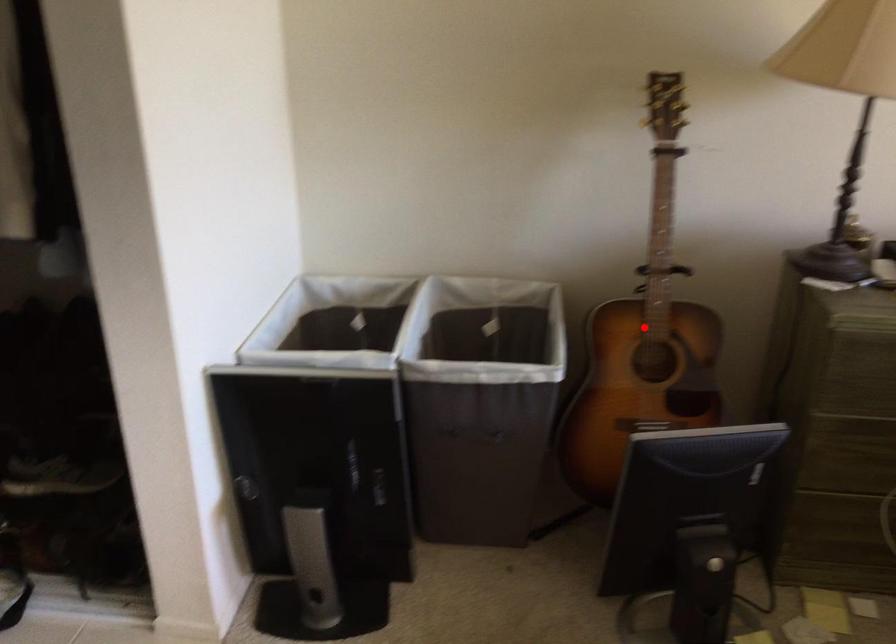
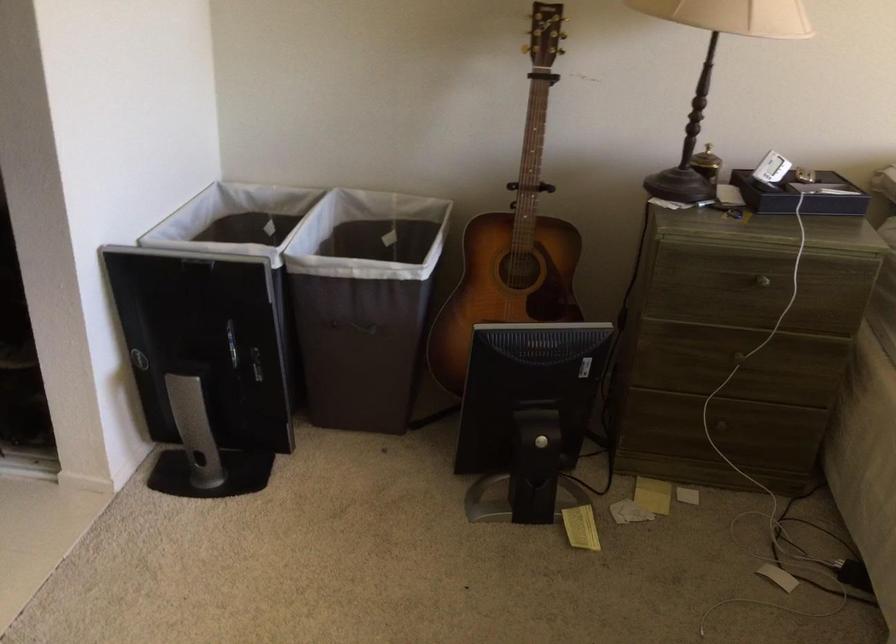
Question: I am providing you with two images of the same scene from different viewpoints. Image1 has a red point marked. In image2, the corresponding 3D location appears at what relative position? Reply with the corresponding letter.

Choices:
 (A) Closer
 (B) Farther

Answer: (B)